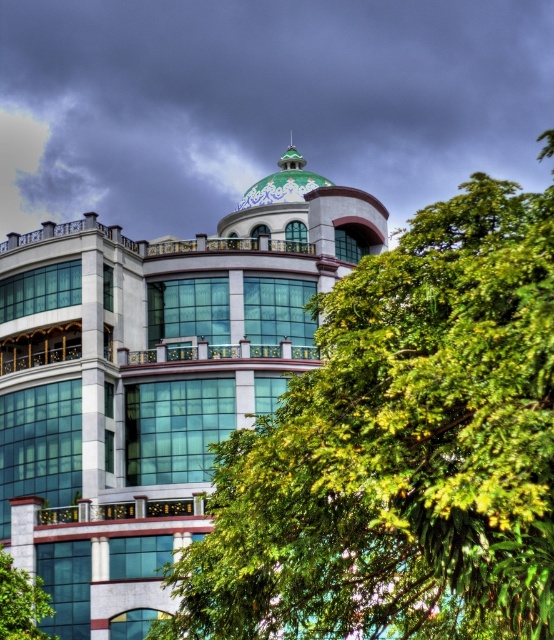
You are standing in front of the building and notice a point marked at coordinates [399,451]. What object is located at that point?

The green leafy tree at upper center is located at point [399,451].

You are an architect reviewing the building design. You notice the green leafy tree at upper center and the green glossy dome at upper center in the image. Which one appears wider in the image?

The green glossy dome at upper center appears wider than the green leafy tree at upper center because the tree has a smaller width compared to the dome.

Looking at this image, you are an architect evaluating the building design. From your perspective, does the green leafy tree at upper center appear wider than the green glass building at center?

The green leafy tree at upper center has a greater width than the green glass building at center, so yes, it appears wider.